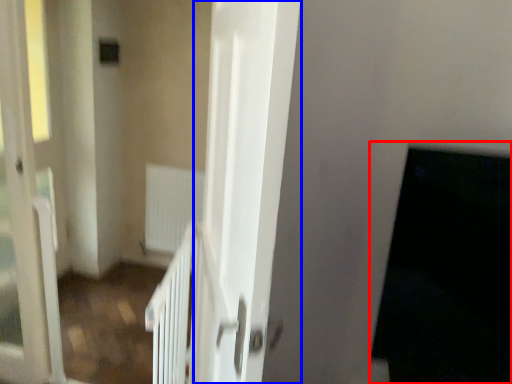
Question: Which object is closer to the camera taking this photo, dark (highlighted by a red box) or screen door (highlighted by a blue box)?

Choices:
 (A) dark
 (B) screen door

Answer: (B)